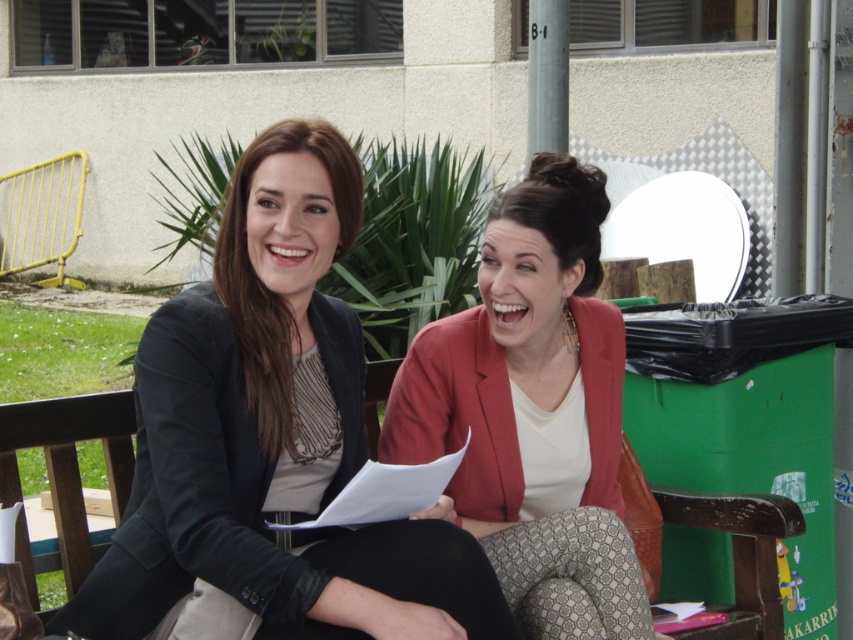
Looking at this image, you are a fashion designer observing two items in the image. You need to determine which item is taller between the matte black blazer at center and the wooden park bench at center. Can you help?

The matte black blazer at center has a greater height compared to the wooden park bench at center, so the matte black blazer at center is taller.

You are a photographer trying to capture the perfect shot of the scene. You want to focus on the matte black blazer at center. Since you know its coordinates, can you confirm if it is positioned to the left or right of the center point of the image?

The coordinates of the matte black blazer at center are at point 0.684 on the x axis and 0.321 on the y axis. Since the center of the image is at 0.5 on both axes, the x coordinate of 0.684 is greater than 0.5, so the matte black blazer at center is positioned to the right of the center point of the image.